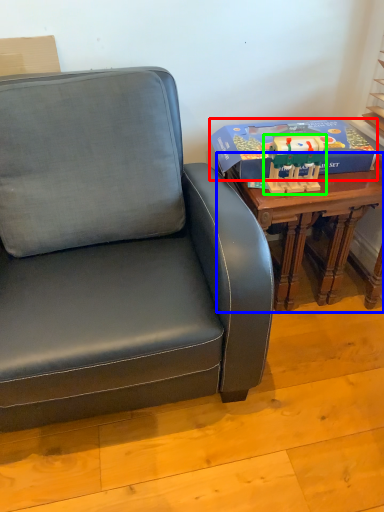
Question: Considering the real-world distances, which object is farthest from box (highlighted by a red box)? table (highlighted by a blue box) or toy (highlighted by a green box)?

Choices:
 (A) table
 (B) toy

Answer: (A)